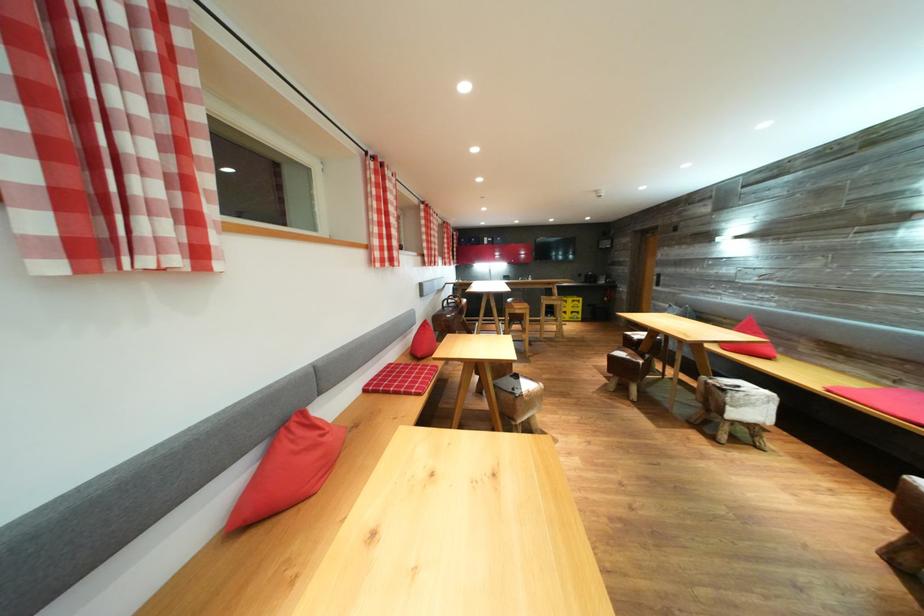
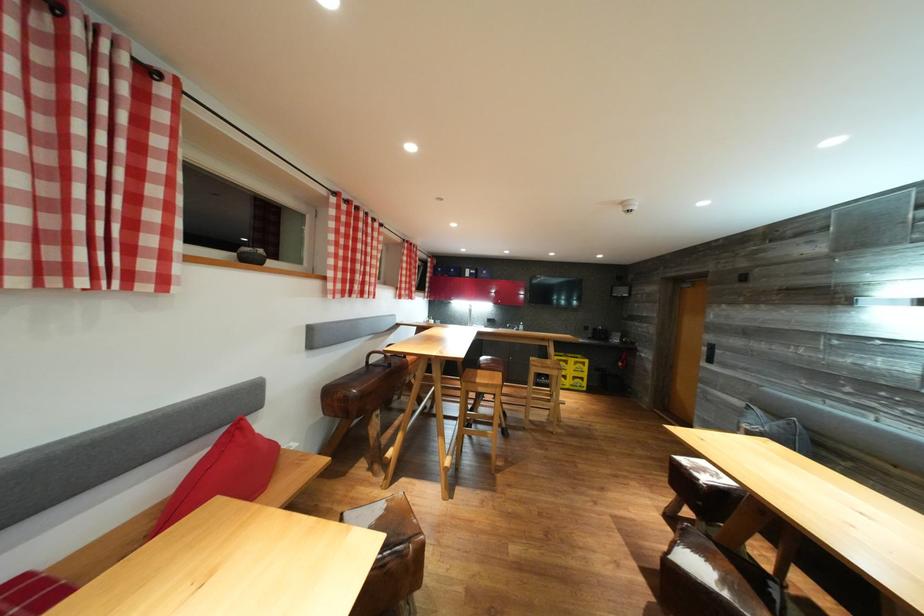
In the second image, find the point that corresponds to pixel 577 305 in the first image.

(578, 366)